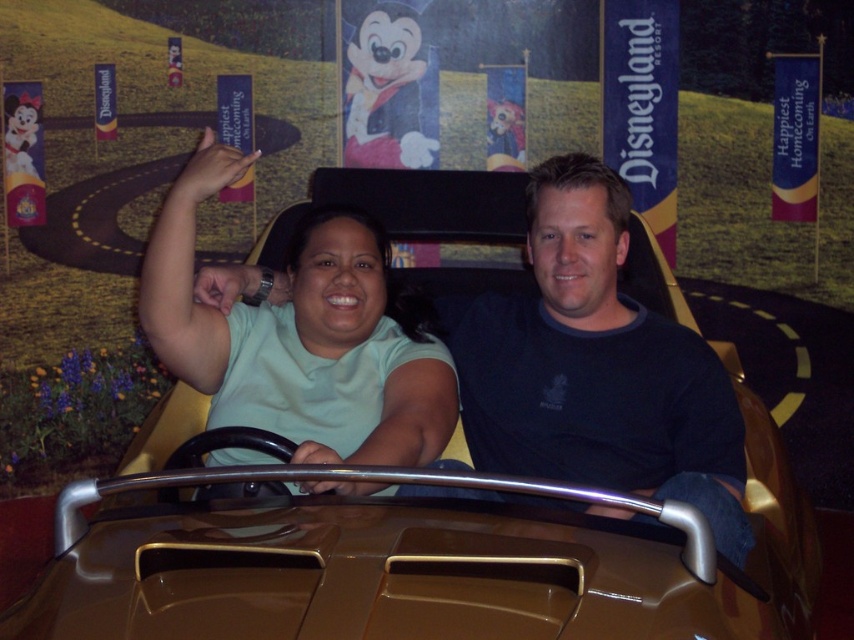
Question: Can you confirm if gold metallic car at center is bigger than matte green shirt at center?

Choices:
 (A) yes
 (B) no

Answer: (A)

Question: Which of the following is the closest to the observer?

Choices:
 (A) (472, 221)
 (B) (576, 272)

Answer: (B)

Question: Can you confirm if dark blue shirt at center is positioned to the right of matte green shirt at center?

Choices:
 (A) yes
 (B) no

Answer: (A)

Question: Is gold metallic car at center to the left of dark blue shirt at center from the viewer's perspective?

Choices:
 (A) yes
 (B) no

Answer: (A)

Question: Which point appears closest to the camera in this image?

Choices:
 (A) (407, 232)
 (B) (369, 339)

Answer: (B)

Question: Which of the following is the farthest from the observer?

Choices:
 (A) dark blue shirt at center
 (B) matte green shirt at center

Answer: (A)